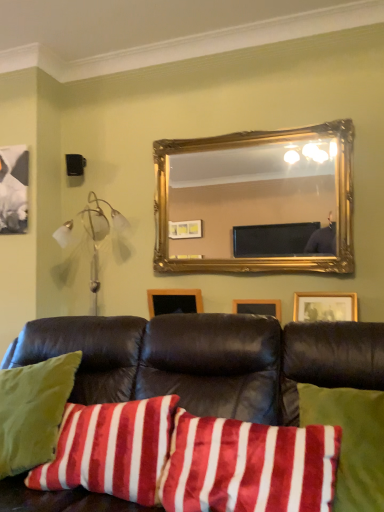
Question: Is wooden picture frame at center smaller than velvety red pillow at center, which appears as the 2th pillow when viewed from the left?

Choices:
 (A) yes
 (B) no

Answer: (A)

Question: From the image's perspective, is wooden picture frame at center on top of velvety red pillow at center, which appears as the 2th pillow when viewed from the left?

Choices:
 (A) yes
 (B) no

Answer: (A)

Question: Considering the relative positions of wooden picture frame at center and velvety red pillow at center, the first pillow positioned from the right, in the image provided, is wooden picture frame at center to the right of velvety red pillow at center, the first pillow positioned from the right, from the viewer's perspective?

Choices:
 (A) no
 (B) yes

Answer: (A)

Question: From a real-world perspective, is wooden picture frame at center on velvety red pillow at center, the first pillow positioned from the right?

Choices:
 (A) yes
 (B) no

Answer: (A)

Question: Would you say wooden picture frame at center contains velvety red pillow at center, the first pillow positioned from the right?

Choices:
 (A) no
 (B) yes

Answer: (A)

Question: Considering the relative sizes of wooden picture frame at center and velvety red pillow at center, the first pillow positioned from the right, in the image provided, is wooden picture frame at center thinner than velvety red pillow at center, the first pillow positioned from the right,?

Choices:
 (A) yes
 (B) no

Answer: (A)

Question: From a real-world perspective, does velvety red pillow at center, the first pillow positioned from the right, stand above wooden picture frame at center?

Choices:
 (A) no
 (B) yes

Answer: (A)

Question: Does velvety red pillow at center, which appears as the 2th pillow when viewed from the left, come in front of wooden picture frame at center?

Choices:
 (A) yes
 (B) no

Answer: (A)

Question: Considering the relative sizes of velvety red pillow at center, which appears as the 2th pillow when viewed from the left, and wooden picture frame at center in the image provided, is velvety red pillow at center, which appears as the 2th pillow when viewed from the left, thinner than wooden picture frame at center?

Choices:
 (A) no
 (B) yes

Answer: (A)

Question: Is velvety red pillow at center, which appears as the 2th pillow when viewed from the left, not near wooden picture frame at center?

Choices:
 (A) yes
 (B) no

Answer: (A)

Question: Can we say velvety red pillow at center, the first pillow positioned from the right, lies outside wooden picture frame at center?

Choices:
 (A) no
 (B) yes

Answer: (B)

Question: Is velvety red pillow at center, which appears as the 2th pillow when viewed from the left, to the left of wooden picture frame at center from the viewer's perspective?

Choices:
 (A) no
 (B) yes

Answer: (A)

Question: Is gold ornate mirror at upper center to the left of wooden picture frame at center from the viewer's perspective?

Choices:
 (A) no
 (B) yes

Answer: (A)